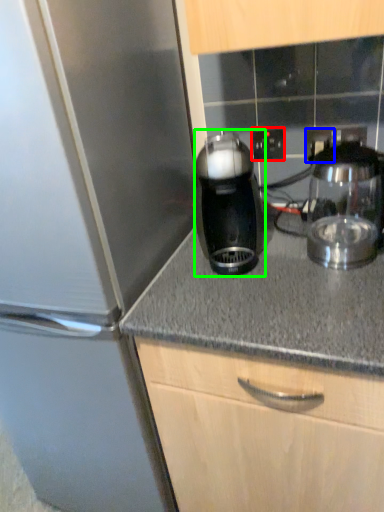
Question: Which object is positioned closest to electric outlet (highlighted by a red box)? Select from electric outlet (highlighted by a blue box) and kitchen appliance (highlighted by a green box).

Choices:
 (A) electric outlet
 (B) kitchen appliance

Answer: (A)